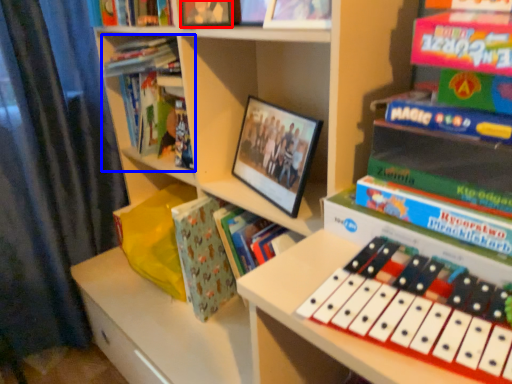
Question: Which object is further to the camera taking this photo, book (highlighted by a red box) or book (highlighted by a blue box)?

Choices:
 (A) book
 (B) book

Answer: (B)